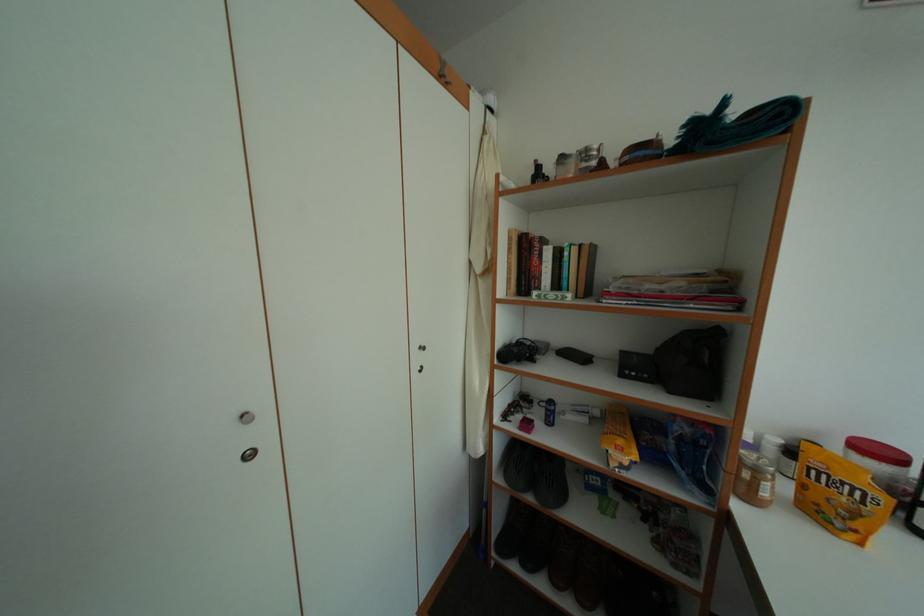
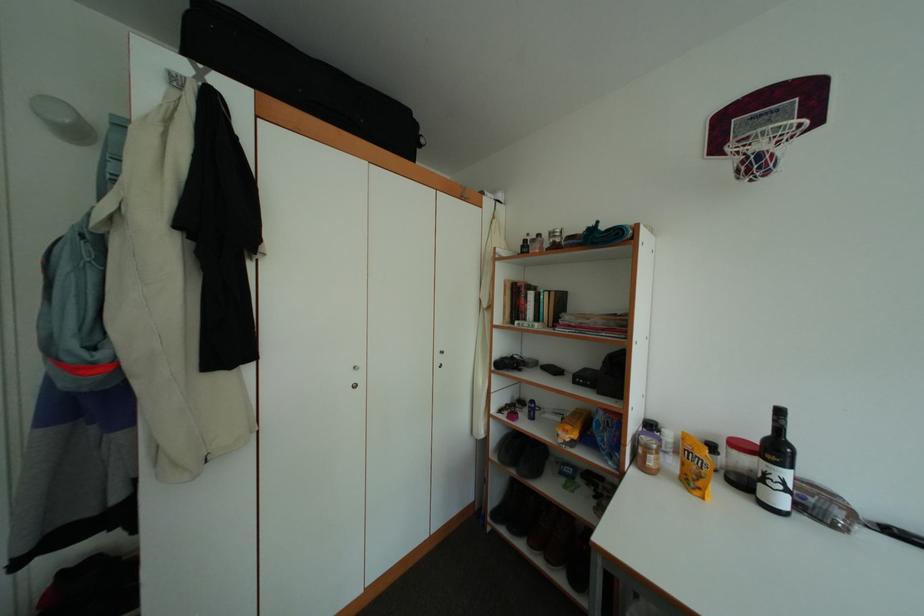
Question: The camera is either moving clockwise (left) or counter-clockwise (right) around the object. The first image is from the beginning of the video and the second image is from the end. Is the camera moving left or right when shooting the video?

Choices:
 (A) Left
 (B) Right

Answer: (B)